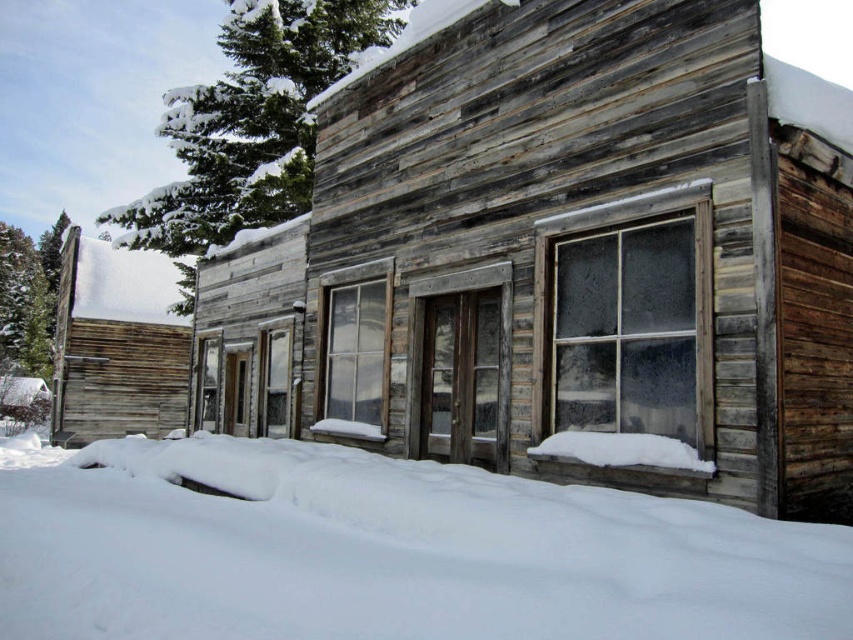
Question: Which object appears farthest from the camera in this image?

Choices:
 (A) white fluffy snow at lower center
 (B) weathered wood cabin at left

Answer: (B)

Question: Where is white fluffy snow at lower center located in relation to weathered wood cabin at left in the image?

Choices:
 (A) right
 (B) left

Answer: (A)

Question: Can you confirm if white fluffy snow at lower center is positioned to the right of weathered wood cabin at left?

Choices:
 (A) yes
 (B) no

Answer: (A)

Question: Is white fluffy snow at lower center to the left of weathered wood cabin at left from the viewer's perspective?

Choices:
 (A) yes
 (B) no

Answer: (B)